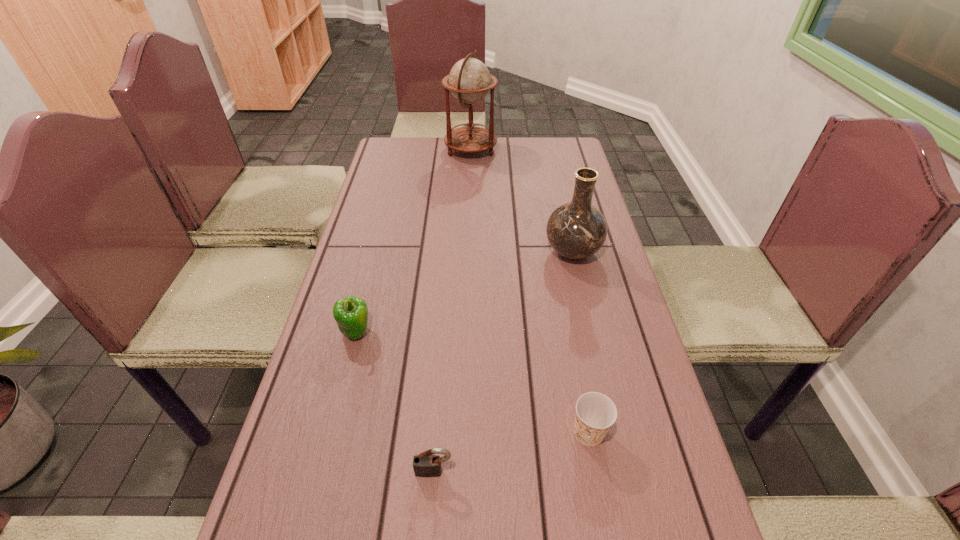
You are a GUI agent. You are given a task and a screenshot of the screen. Output one action in this format:
    pyautogui.click(x=<x>, y=<y>)
    Task: Click on the free area in between the padlock and the globe
    
    Given the screenshot: What is the action you would take?
    pyautogui.click(x=452, y=310)

Locate an element on the screen. The width and height of the screenshot is (960, 540). the second closest object to the padlock is located at coordinates (351, 313).

This screenshot has width=960, height=540. Find the location of `object that is the second closest to the globe`. object that is the second closest to the globe is located at coordinates (351, 313).

Locate an element on the screen. vacant position in the image that satisfies the following two spatial constraints: 1. on the surface of the globe; 2. on the right side of the vase is located at coordinates (468, 252).

This screenshot has height=540, width=960. Identify the location of vacant space that satisfies the following two spatial constraints: 1. on the back side of the fourth nearest object; 2. on the surface of the farthest object. (549, 150).

Locate an element on the screen. The height and width of the screenshot is (540, 960). vacant point that satisfies the following two spatial constraints: 1. on the back side of the Dixie cup; 2. on the left side of the vase is located at coordinates (555, 252).

This screenshot has height=540, width=960. I want to click on vacant space that satisfies the following two spatial constraints: 1. on the surface of the farthest object; 2. with the keyhole on the front of the nearest object, so click(x=461, y=471).

The height and width of the screenshot is (540, 960). Find the location of `free spot that satisfies the following two spatial constraints: 1. on the surface of the globe; 2. on the back side of the fourth shortest object`. free spot that satisfies the following two spatial constraints: 1. on the surface of the globe; 2. on the back side of the fourth shortest object is located at coordinates (468, 252).

At what (x,y) coordinates should I click in order to perform the action: click on vacant space that satisfies the following two spatial constraints: 1. on the front side of the Dixie cup; 2. on the right side of the third farthest object. Please return your answer as a coordinate pair (x, y). Looking at the image, I should click on (329, 433).

Locate an element on the screen. vacant space that satisfies the following two spatial constraints: 1. on the surface of the globe; 2. on the right side of the second farthest object is located at coordinates (468, 252).